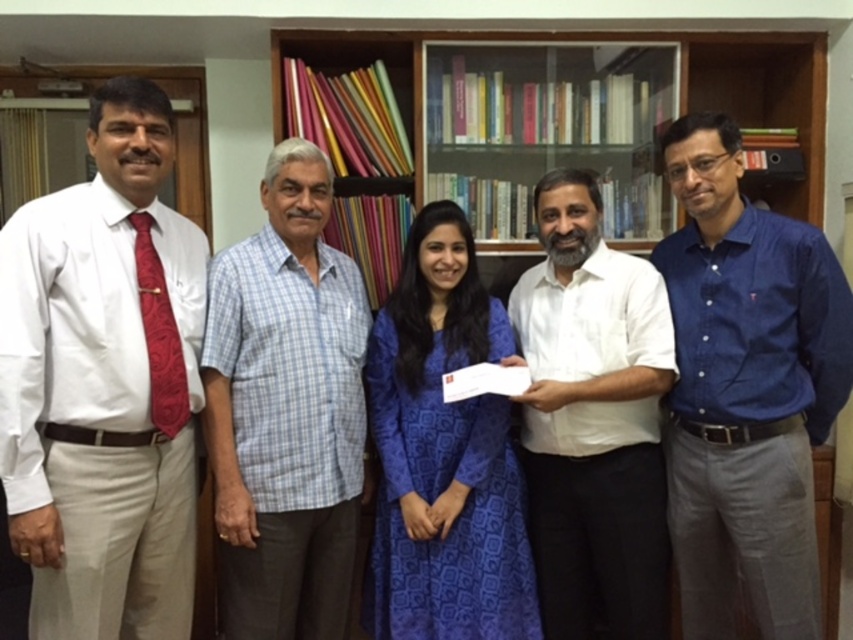
You are an interior designer assessing the layout of this office space. You notice the blue printed dress at center and the wooden bookshelf at upper center. Based on their relative heights, which object would you consider adjusting to improve the visual balance of the room?

The blue printed dress at center is taller than the wooden bookshelf at upper center. To improve visual balance, you might consider adjusting the height of the wooden bookshelf at upper center to match or exceed the height of the dress, or rearranging their positions to create a more harmonious proportion between them.

Based on the photo, you are a photographer standing in the office scene. You want to take a photo of the white satin shirt at left without moving any objects. Can you position yourself so that the camera is close enough to capture the shirt clearly?

The white satin shirt at left and camera are 5.32 feet apart. Since 5.32 feet is a reasonable distance for a photographer to capture a clear image, yes, you can position yourself close enough to the white satin shirt at left to take a clear photo.

You are standing in the office and need to reach both points to place a document. Which point, point (430, 556) or point (769, 97), is closer to you?

Point (430, 556) is closer to the viewer than point (769, 97), so you should reach for it first.